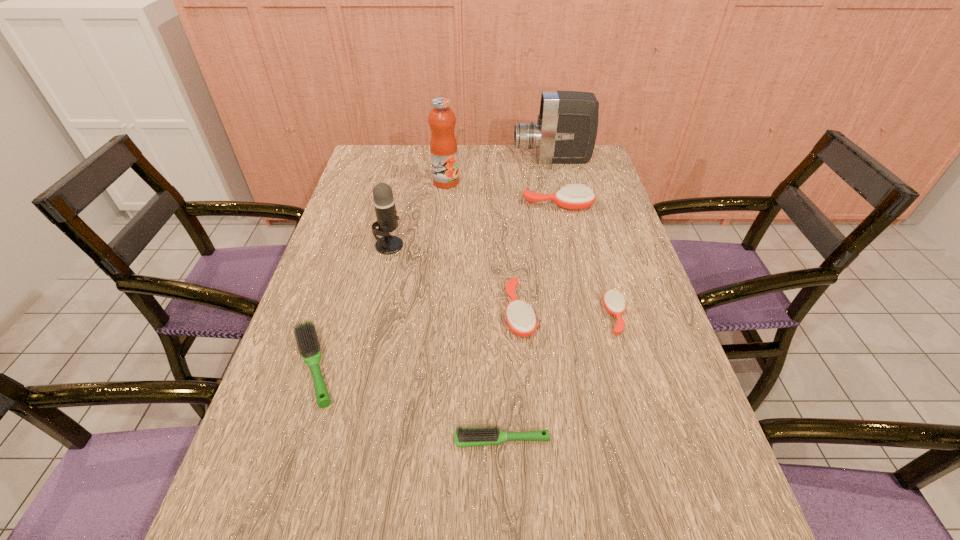
You are a GUI agent. You are given a task and a screenshot of the screen. Output one action in this format:
    pyautogui.click(x=<x>, y=<y>)
    Task: Click on the leftmost hairbrush
    
    Given the screenshot: What is the action you would take?
    pyautogui.click(x=307, y=339)

Locate an element on the screen. The width and height of the screenshot is (960, 540). the smallest orange hairbrush is located at coordinates (614, 303).

Where is `the right light hairbrush`? Image resolution: width=960 pixels, height=540 pixels. the right light hairbrush is located at coordinates (464, 437).

Image resolution: width=960 pixels, height=540 pixels. Find the location of `the shortest hairbrush`. the shortest hairbrush is located at coordinates (464, 437).

The image size is (960, 540). I want to click on vacant space located 0.150m on the front label of the sixth object from right to left, so click(443, 216).

Where is `vacant space located at the front of the farthest object, highlighting the lens`? vacant space located at the front of the farthest object, highlighting the lens is located at coordinates (447, 160).

Identify the location of vacant space located 0.140m at the front of the farthest object, highlighting the lens. The image size is (960, 540). (475, 160).

At what (x,y) coordinates should I click in order to perform the action: click on vacant space situated 0.280m at the front of the farthest object, highlighting the lens. Please return your answer as a coordinate pair (x, y). Image resolution: width=960 pixels, height=540 pixels. Looking at the image, I should click on (437, 160).

Image resolution: width=960 pixels, height=540 pixels. Identify the location of free space located 0.380m on the front of the sixth shortest object. (360, 370).

The width and height of the screenshot is (960, 540). What are the coordinates of `free space located 0.210m on the back of the farthest orange hairbrush` in the screenshot? It's located at (549, 165).